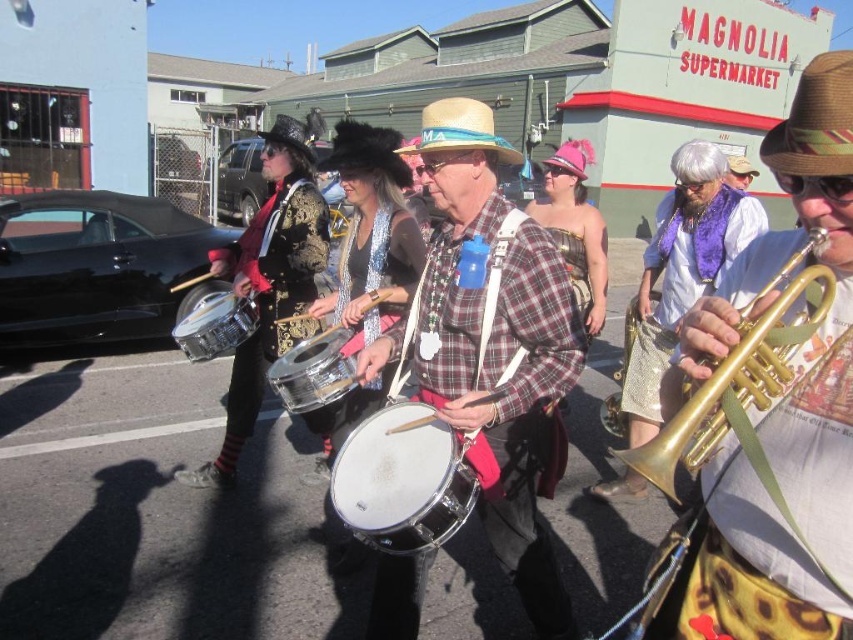
You are a street performer who needs to choose a drum for a performance. The metallic silver drum at center and the brushed metal drum at left are available. Which drum is taller?

The metallic silver drum at center is taller than the brushed metal drum at left.

Consider the image. You are a photographer trying to capture the trumpet and the hat in the same frame. Since the gold brass trumpet at right is shorter than the brown woven cowboy hat at upper right, which object should you adjust your camera angle to focus on first to ensure both are in the frame?

Since the gold brass trumpet at right is shorter than the brown woven cowboy hat at upper right, you should first focus on the taller brown woven cowboy hat at upper right to ensure it fits within the frame, then adjust to include the shorter gold brass trumpet at right.